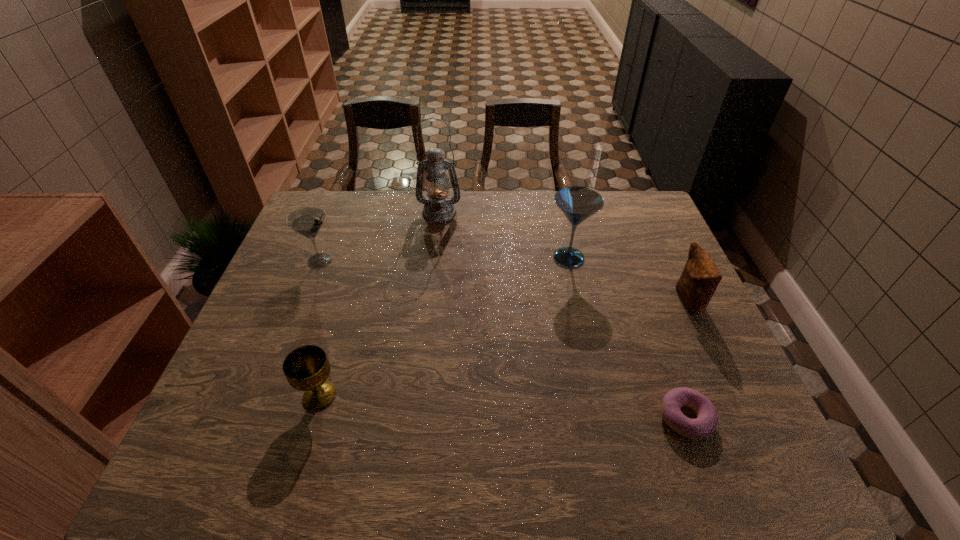
The width and height of the screenshot is (960, 540). I want to click on object that is at the near edge, so pyautogui.click(x=703, y=426).

Locate an element on the screen. Image resolution: width=960 pixels, height=540 pixels. object that is at the left edge is located at coordinates [308, 221].

This screenshot has height=540, width=960. Identify the location of clutch bag that is at the right edge. (700, 278).

Locate an element on the screen. doughnut that is at the right edge is located at coordinates (703, 426).

Locate an element on the screen. This screenshot has height=540, width=960. object located in the near right corner section of the desktop is located at coordinates (703, 426).

At what (x,y) coordinates should I click in order to perform the action: click on free region at the far edge of the desktop. Please return your answer as a coordinate pair (x, y). Looking at the image, I should click on (461, 191).

The image size is (960, 540). In the image, there is a desktop. In order to click on vacant space at the near edge in this screenshot , I will do `click(364, 463)`.

Image resolution: width=960 pixels, height=540 pixels. Find the location of `free space at the left edge of the desktop`. free space at the left edge of the desktop is located at coordinates (277, 344).

Where is `vacant space at the right edge of the desktop`? vacant space at the right edge of the desktop is located at coordinates (651, 322).

This screenshot has width=960, height=540. What are the coordinates of `vacant area at the near left corner of the desktop` in the screenshot? It's located at (239, 464).